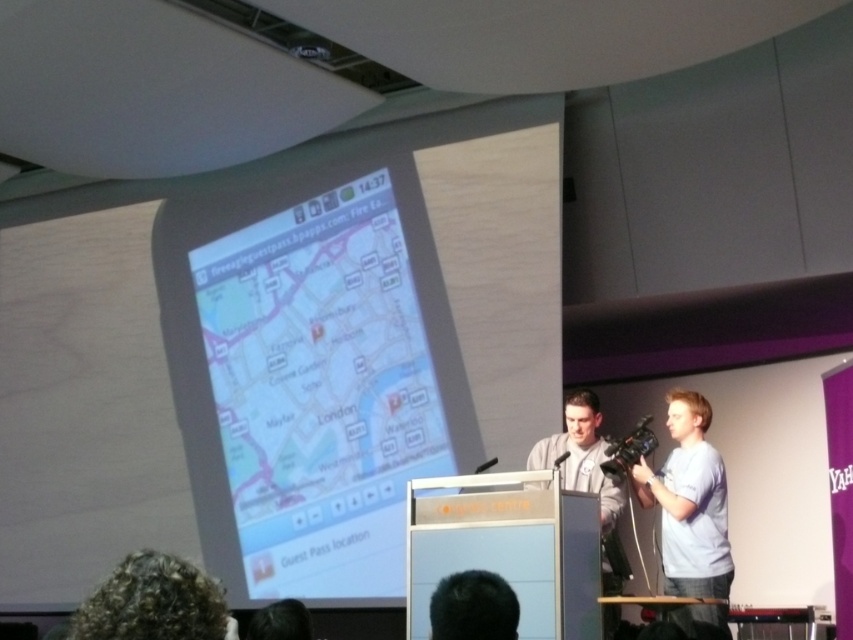
You are organizing a presentation and need to ensure all participants can see the screen clearly. Considering the positions of the light blue cotton shirt at right and curly hair at lower left, which participant is closer to the screen and thus less likely to block the view?

The light blue cotton shirt at right has a larger size compared to curly hair at lower left, so the light blue cotton shirt at right is closer to the screen and less likely to block the view.

You are attending a presentation in a conference room. You notice two people near the podium. One has curly hair at lower left and the other is wearing a light blue cotton shirt at right. From your perspective, which person is closer to the front of the stage?

The light blue cotton shirt at right is closer to the front of the stage because the curly hair at lower left is behind it.